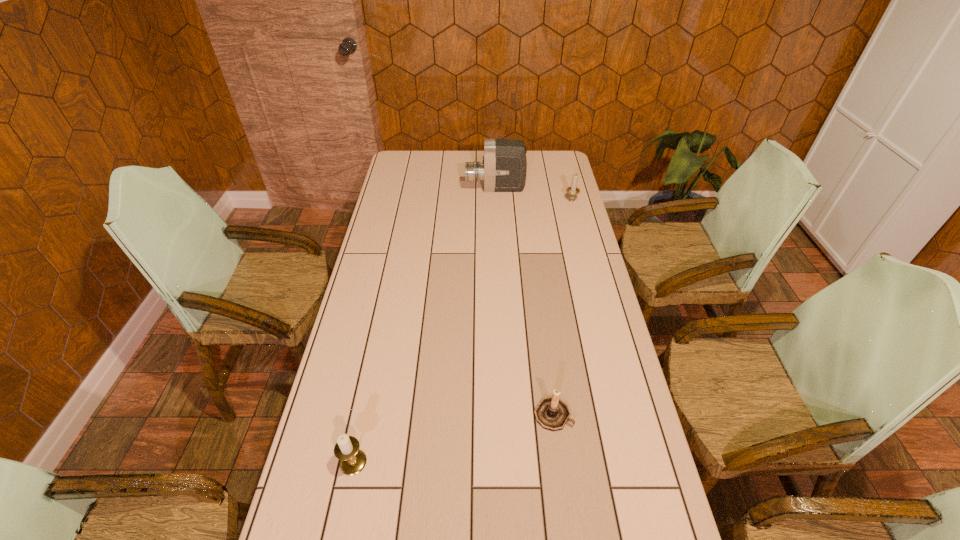
This screenshot has width=960, height=540. What are the coordinates of `vacant space that satisfies the following two spatial constraints: 1. at the front of the third farthest object, highlighting the lens; 2. on the right side of the camcorder` in the screenshot? It's located at [x=506, y=414].

At what (x,y) coordinates should I click in order to perform the action: click on vacant point that satisfies the following two spatial constraints: 1. at the front of the camcorder, highlighting the lens; 2. on the right side of the second nearest candle holder. Please return your answer as a coordinate pair (x, y). The width and height of the screenshot is (960, 540). Looking at the image, I should click on (506, 414).